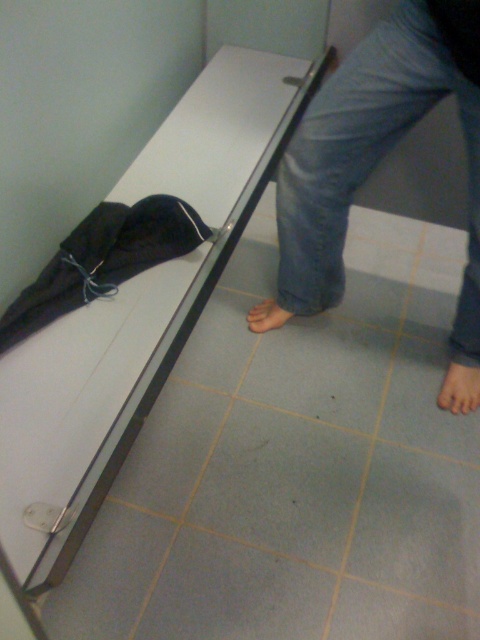
You are a photographer setting up a shot of the scene. You notice a point marked at coordinates [459,388]. What object or feature does this point correspond to in the scene?

The point at coordinates [459,388] corresponds to the pinkish matte skin at lower right.

Looking at this image, you are a fashion designer observing the scene. You need to determine if the denim pants at lower right can accommodate the brown matte foot at lower center. Based on the spatial relationship between them, can the foot fit comfortably inside the pants?

The denim pants at lower right might be wider than brown matte foot at lower center, so the foot can fit comfortably inside the pants.